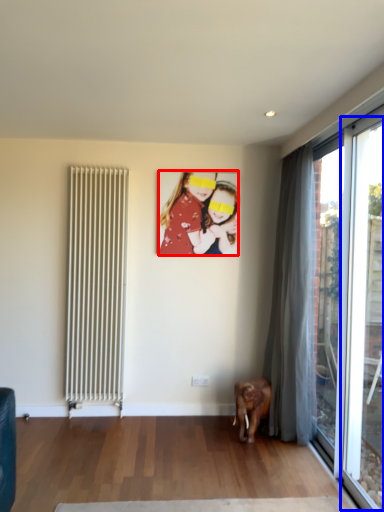
Question: Which of the following is the closest to the observer, person (highlighted by a red box) or window (highlighted by a blue box)?

Choices:
 (A) person
 (B) window

Answer: (B)